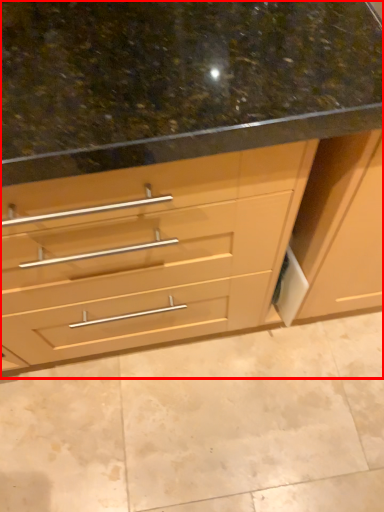
Question: From the image, what is the correct spatial relationship of cabinetry (annotated by the red box) in relation to granite?

Choices:
 (A) left
 (B) right

Answer: (B)